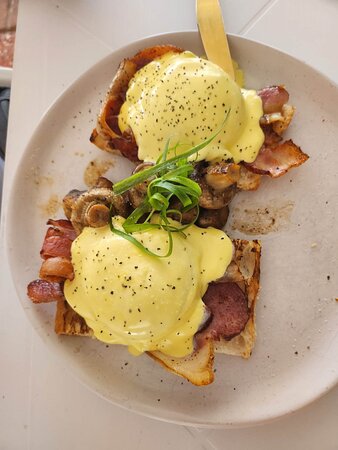
Locate an element on the screen. This screenshot has height=450, width=338. line on tabletop is located at coordinates (84, 30), (31, 406), (205, 441), (44, 82), (258, 16).